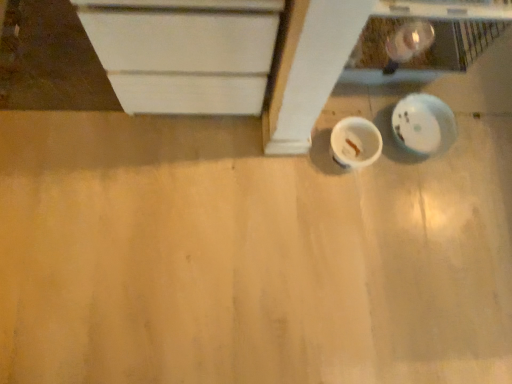
Question: Could you tell me if white glossy plate at lower right is facing white matte cup at center?

Choices:
 (A) yes
 (B) no

Answer: (B)

Question: Does white glossy plate at lower right appear on the left side of white matte cup at center?

Choices:
 (A) no
 (B) yes

Answer: (A)

Question: Would you say white glossy plate at lower right is a long distance from white matte cup at center?

Choices:
 (A) no
 (B) yes

Answer: (A)

Question: From the image's perspective, does white glossy plate at lower right appear higher than white matte cup at center?

Choices:
 (A) yes
 (B) no

Answer: (A)

Question: Is white glossy plate at lower right facing away from white matte cup at center?

Choices:
 (A) yes
 (B) no

Answer: (B)

Question: Is white matte cabinet at upper left taller or shorter than white glossy plate at lower right?

Choices:
 (A) short
 (B) tall

Answer: (B)

Question: Is white matte cabinet at upper left situated inside white glossy plate at lower right or outside?

Choices:
 (A) outside
 (B) inside

Answer: (A)

Question: In terms of size, does white matte cabinet at upper left appear bigger or smaller than white glossy plate at lower right?

Choices:
 (A) big
 (B) small

Answer: (A)

Question: Considering the positions of white matte cabinet at upper left and white glossy plate at lower right in the image, is white matte cabinet at upper left wider or thinner than white glossy plate at lower right?

Choices:
 (A) wide
 (B) thin

Answer: (A)

Question: In terms of width, does white glossy plate at lower right look wider or thinner when compared to white matte cup at center?

Choices:
 (A) thin
 (B) wide

Answer: (B)

Question: In the image, is white glossy plate at lower right on the left side or the right side of white matte cup at center?

Choices:
 (A) right
 (B) left

Answer: (A)

Question: From a real-world perspective, is white glossy plate at lower right positioned above or below white matte cup at center?

Choices:
 (A) above
 (B) below

Answer: (B)

Question: Is white glossy plate at lower right bigger or smaller than white matte cup at center?

Choices:
 (A) big
 (B) small

Answer: (A)

Question: Is white matte cabinet at upper left taller or shorter than matte white plywood at lower right?

Choices:
 (A) short
 (B) tall

Answer: (B)

Question: Would you say white matte cabinet at upper left is inside or outside matte white plywood at lower right?

Choices:
 (A) inside
 (B) outside

Answer: (B)